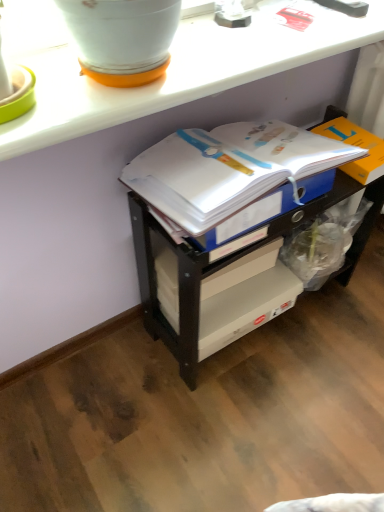
I want to click on free space in front of white plastic shelf at center, so click(251, 422).